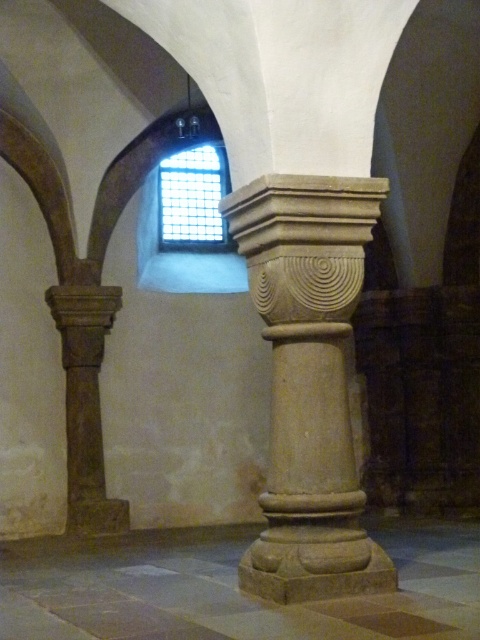
Question: Which of the following is the closest to the observer?

Choices:
 (A) beige stone column at center
 (B) brown stone column at left

Answer: (A)

Question: Can you confirm if beige stone column at center is positioned to the left of smooth stone column at center?

Choices:
 (A) yes
 (B) no

Answer: (A)

Question: Which of the following is the farthest from the observer?

Choices:
 (A) brown stone column at left
 (B) clear glass window at upper center
 (C) beige stone column at center
 (D) smooth stone column at center

Answer: (B)

Question: Does beige stone column at center have a larger size compared to brown stone column at left?

Choices:
 (A) yes
 (B) no

Answer: (A)

Question: Among these points, which one is nearest to the camera?

Choices:
 (A) pyautogui.click(x=332, y=490)
 (B) pyautogui.click(x=88, y=422)
 (C) pyautogui.click(x=208, y=154)
 (D) pyautogui.click(x=82, y=573)

Answer: (A)

Question: Can you confirm if beige stone column at center is smaller than clear glass window at upper center?

Choices:
 (A) yes
 (B) no

Answer: (B)